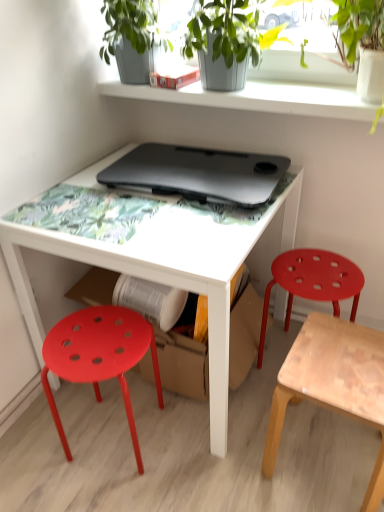
Locate an element on the screen. vacant area to the left of black matte laptop at center is located at coordinates (77, 197).